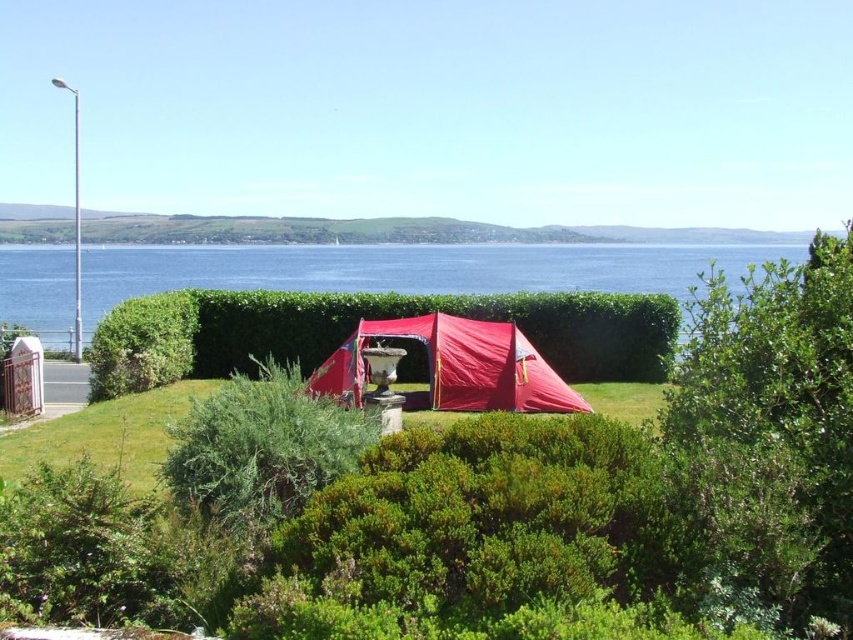
Question: Which point appears closest to the camera in this image?

Choices:
 (A) (219, 432)
 (B) (444, 272)
 (C) (566, 358)

Answer: (A)

Question: Does green leafy hedge at center have a lesser width compared to matte red tent at center?

Choices:
 (A) yes
 (B) no

Answer: (B)

Question: Which of these objects is positioned closest to the green leafy bush at center?

Choices:
 (A) transparent water at center
 (B) matte red tent at center
 (C) green leafy hedge at center

Answer: (B)

Question: Can you confirm if transparent water at center is bigger than green leafy bush at center?

Choices:
 (A) no
 (B) yes

Answer: (B)

Question: Which point appears closest to the camera in this image?

Choices:
 (A) (519, 332)
 (B) (286, 515)

Answer: (B)

Question: Is transparent water at center thinner than green leafy hedge at center?

Choices:
 (A) no
 (B) yes

Answer: (A)